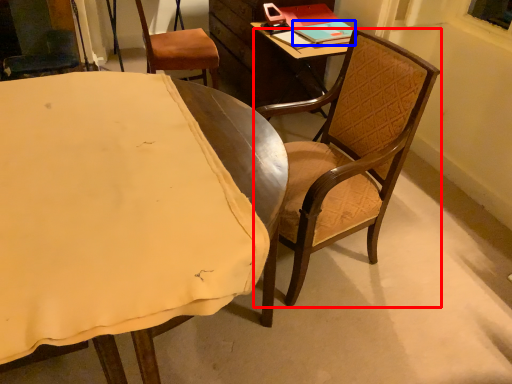
Question: Which object is closer to the camera taking this photo, chair (highlighted by a red box) or book (highlighted by a blue box)?

Choices:
 (A) chair
 (B) book

Answer: (A)